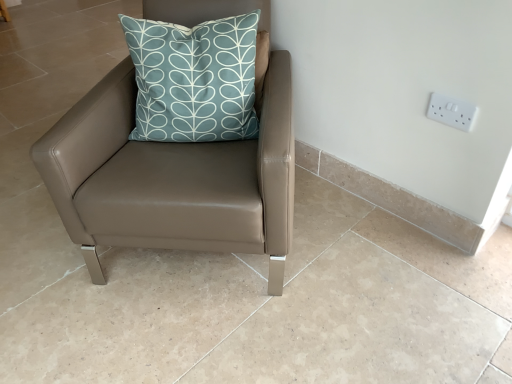
Question: In terms of size, does teal fabric cushion at upper center appear bigger or smaller than white plastic electric outlet at upper right?

Choices:
 (A) big
 (B) small

Answer: (A)

Question: Is teal fabric cushion at upper center wider or thinner than white plastic electric outlet at upper right?

Choices:
 (A) thin
 (B) wide

Answer: (B)

Question: Which object is positioned closest to the white plastic electric outlet at upper right?

Choices:
 (A) matte brown leather chair at center
 (B) teal fabric cushion at upper center

Answer: (B)

Question: Considering the real-world distances, which object is farthest from the teal fabric cushion at upper center?

Choices:
 (A) white plastic electric outlet at upper right
 (B) matte brown leather chair at center

Answer: (A)